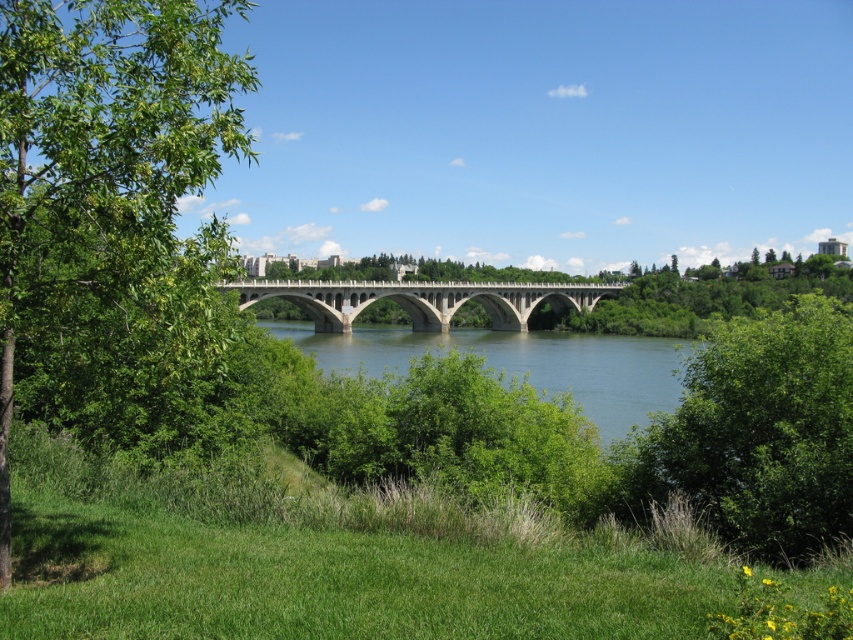
From the picture: You are a gardener planning to transplant the green leafy tree at left and the green leafy bush at right to a new garden plot. If the plot has space for plants up to the width of the wider of the two, which one determines the maximum allowed width for the plot?

The green leafy tree at left determines the maximum allowed width for the plot since its width surpasses that of the green leafy bush at right.

You are standing on the green leafy tree at left and want to walk to the blue concrete bridge at center. Which direction should you move to reach it?

Since the green leafy tree at left is closer to the viewer than the blue concrete bridge at center, you should move forward to reach the blue concrete bridge at center.